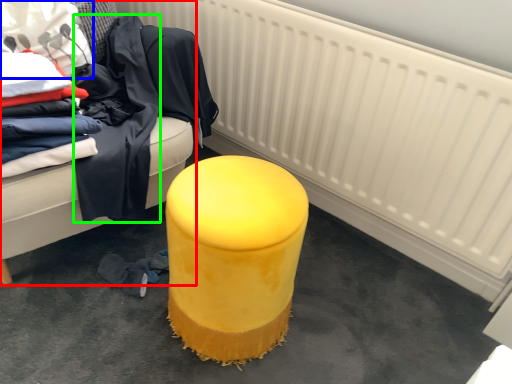
Question: Considering the real-world distances, which object is farthest from furniture (highlighted by a red box)? clothing (highlighted by a blue box) or clothing (highlighted by a green box)?

Choices:
 (A) clothing
 (B) clothing

Answer: (A)